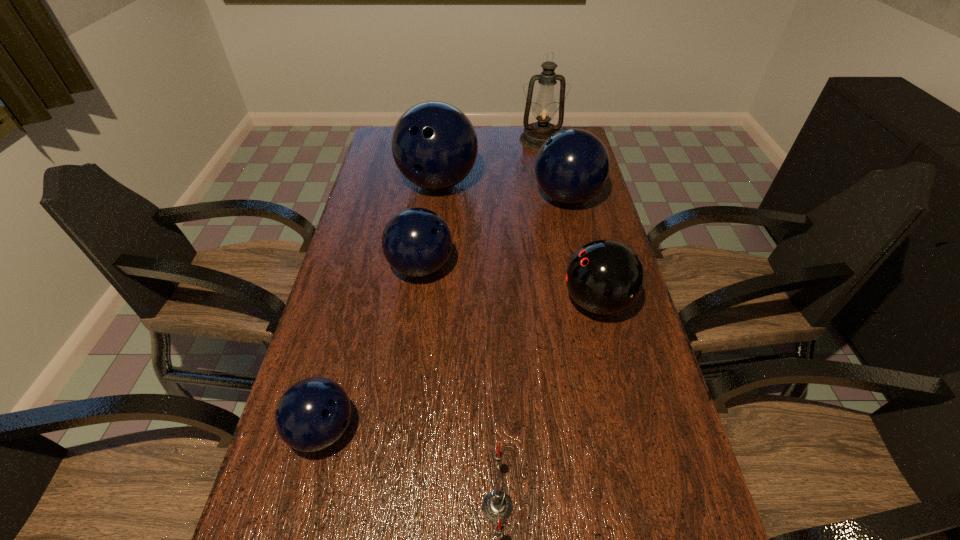
Point out which bowling ball is positioned as the third nearest to the farthest object. Please provide its 2D coordinates. Your answer should be formatted as a tuple, i.e. [(x, y)], where the tuple contains the x and y coordinates of a point satisfying the conditions above.

[(416, 242)]

Locate which blue bowling ball ranks in proximity to the second biggest blue bowling ball. Please provide its 2D coordinates. Your answer should be formatted as a tuple, i.e. [(x, y)], where the tuple contains the x and y coordinates of a point satisfying the conditions above.

[(434, 144)]

Locate which blue bowling ball ranks second in proximity to the fifth shortest object. Please provide its 2D coordinates. Your answer should be formatted as a tuple, i.e. [(x, y)], where the tuple contains the x and y coordinates of a point satisfying the conditions above.

[(416, 242)]

Locate an element on the screen. vacant region that satisfies the following two spatial constraints: 1. on the surface of the second tallest object near the finger holes; 2. on the surface of the second nearest blue bowling ball near the finger holes is located at coordinates (428, 267).